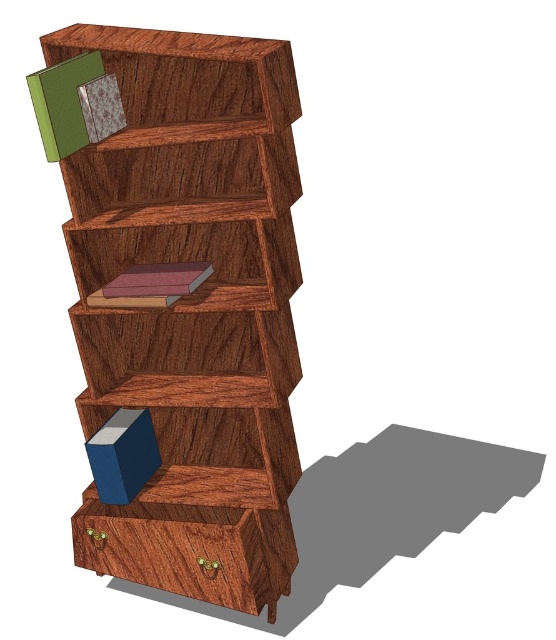
You are organizing books on the wooden bookshelf and notice the green matte book at upper left and the blue matte book at lower center. Which book is placed higher up on the bookshelf?

The green matte book at upper left is placed higher up on the bookshelf than the blue matte book at lower center.

You are trying to place the blue matte book at lower center on the wooden bookcase at center. Based on their sizes, can you determine if the book will fit on the bookcase?

The wooden bookcase at center might be wider than blue matte book at lower center, so there is a possibility that the blue matte book at lower center will fit on the wooden bookcase at center.

You are standing in a room and want to place a new book on the wooden bookcase at center. If your arm can reach up to 6 feet, can you reach the topmost shelf?

The wooden bookcase at center is 7.07 feet away from the viewer, so you cannot reach the topmost shelf since your arm can only reach up to 6 feet.